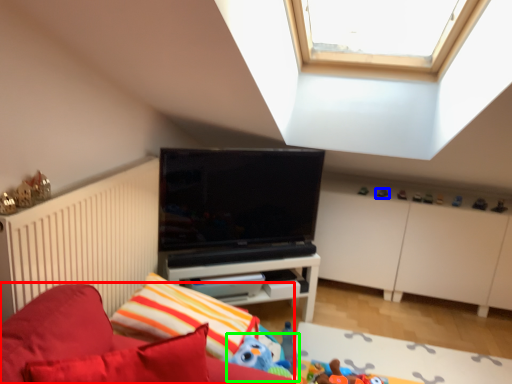
Question: Estimate the real-world distances between objects in this image. Which object is closer to furniture (highlighted by a red box), toy (highlighted by a blue box) or toy (highlighted by a green box)?

Choices:
 (A) toy
 (B) toy

Answer: (B)